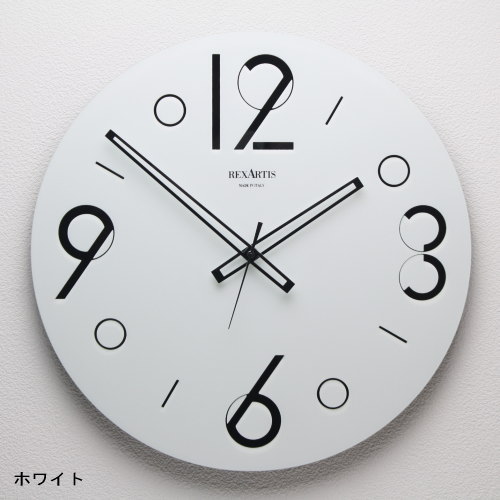
I want to click on analog wall clock, so click(x=181, y=234).